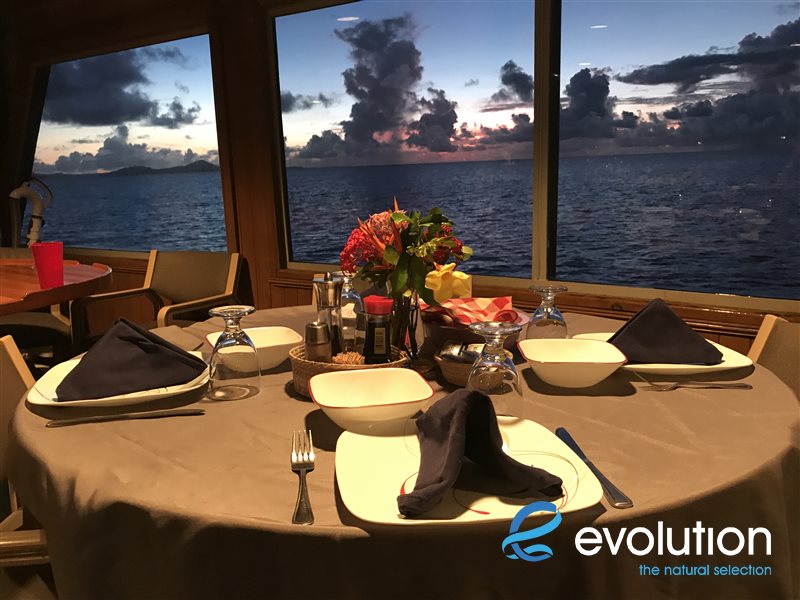
This screenshot has width=800, height=600. Identify the location of basket. (294, 363), (405, 356).